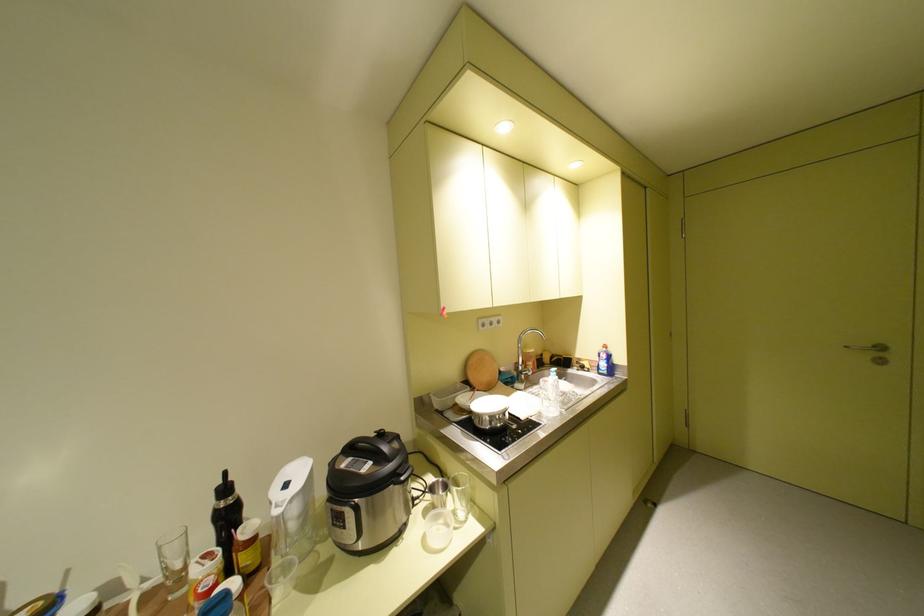
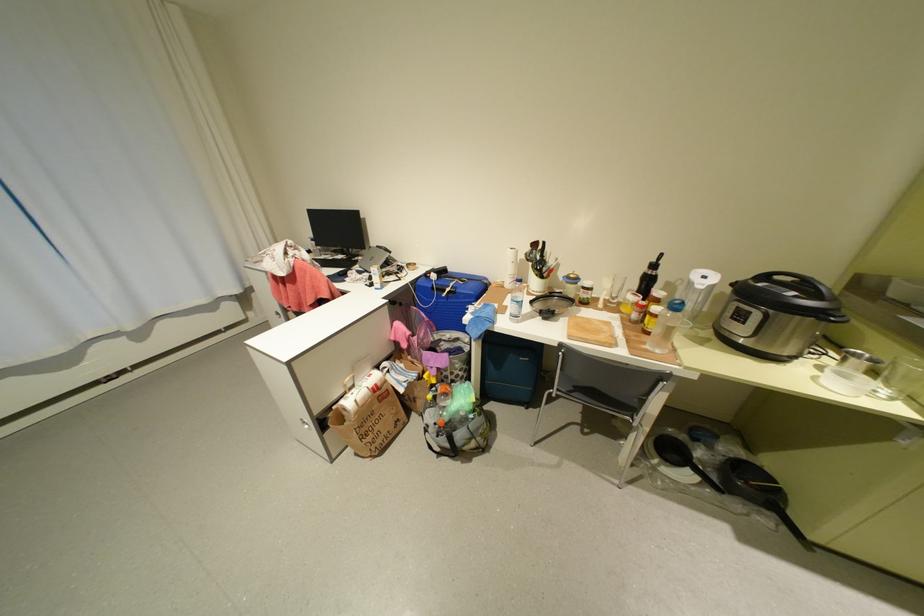
Find the pixel in the second image that matches the point at 412,479 in the first image.

(844, 320)